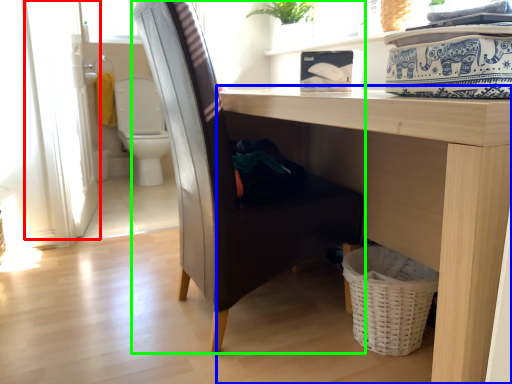
Question: Which object is the farthest from screen door (highlighted by a red box)? Choose among these: table (highlighted by a blue box) or chair (highlighted by a green box).

Choices:
 (A) table
 (B) chair

Answer: (A)